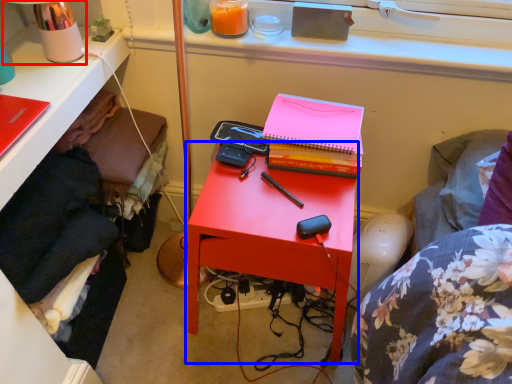
Question: Which object is closer to the camera taking this photo, table lamp (highlighted by a red box) or nightstand (highlighted by a blue box)?

Choices:
 (A) table lamp
 (B) nightstand

Answer: (A)